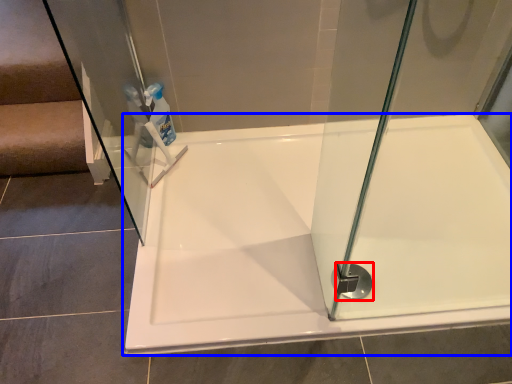
Question: Which point is further to the camera, shower (highlighted by a red box) or bathtub (highlighted by a blue box)?

Choices:
 (A) shower
 (B) bathtub

Answer: (A)